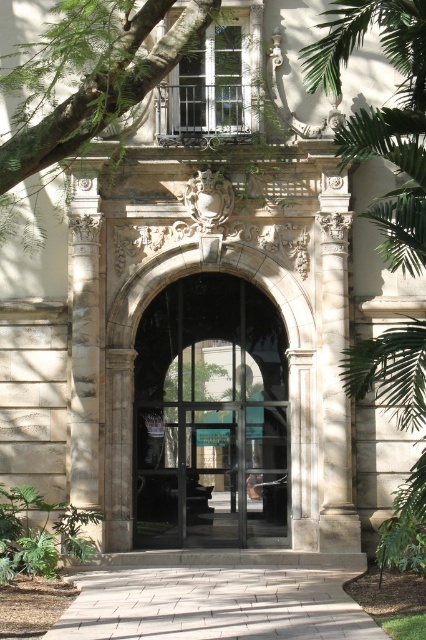
Does point (160, 76) come behind point (373, 364)?

No, it is in front of (373, 364).

Can you confirm if green leafy tree at upper left is bigger than green leafy tree at right?

Indeed, green leafy tree at upper left has a larger size compared to green leafy tree at right.

Find the location of a particular element. green leafy tree at upper left is located at coordinates (83, 90).

Is point (278, 413) closer to camera compared to point (106, 102)?

That is False.

Is clear glass door at center taller than green leafy tree at upper left?

No, clear glass door at center is not taller than green leafy tree at upper left.

Which is behind, point (233, 509) or point (83, 116)?

The point (233, 509) is more distant.

Image resolution: width=426 pixels, height=640 pixels. Identify the location of clear glass door at center. (210, 417).

Who is taller, clear glass door at center or green leafy tree at right?

With more height is green leafy tree at right.

Which is below, clear glass door at center or green leafy tree at right?

clear glass door at center is below.

Does point (275, 465) come farther from viewer compared to point (377, 205)?

Yes.

Where is `clear glass door at center`? clear glass door at center is located at coordinates (210, 417).